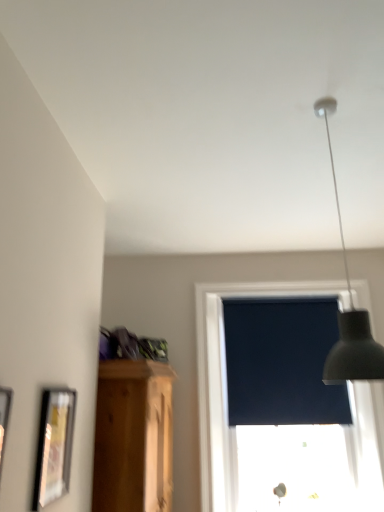
Question: From a real-world perspective, is matte black lampshade at upper right above or below wooden picture frame at left, the first picture frame when ordered from front to back?

Choices:
 (A) above
 (B) below

Answer: (A)

Question: From their relative heights in the image, would you say matte black lampshade at upper right is taller or shorter than wooden picture frame at left, the first picture frame when ordered from front to back?

Choices:
 (A) tall
 (B) short

Answer: (A)

Question: Which object is positioned farthest from the dark matte window screen at center?

Choices:
 (A) wooden picture frame at left, the first picture frame when ordered from front to back
 (B) matte black roller blind at upper right
 (C) matte black lampshade at upper right
 (D) matte black picture frame at lower left, the 1th picture frame viewed from the back

Answer: (A)

Question: Which object is the farthest from the dark matte window screen at center?

Choices:
 (A) matte black lampshade at upper right
 (B) matte black picture frame at lower left, the 2th picture frame from the front
 (C) matte black roller blind at upper right
 (D) wooden picture frame at left, the 2th picture frame in the back-to-front sequence

Answer: (D)